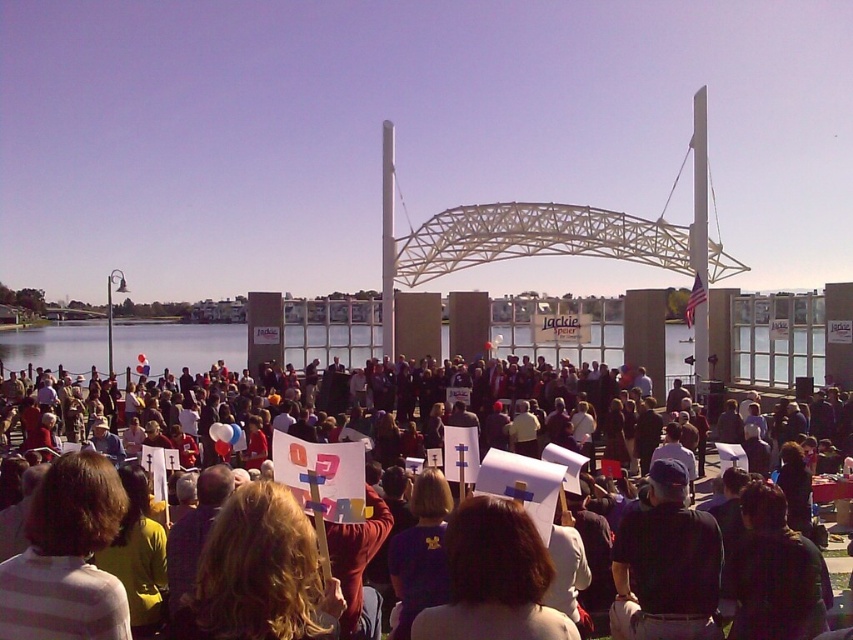
Question: Which point appears farthest from the camera in this image?

Choices:
 (A) (309, 426)
 (B) (657, 488)

Answer: (A)

Question: Which object appears closest to the camera in this image?

Choices:
 (A) dark blue fabric at center
 (B) white paper signs at center

Answer: (B)

Question: Is white paper signs at center positioned behind dark blue fabric at center?

Choices:
 (A) yes
 (B) no

Answer: (B)

Question: Can you confirm if white paper signs at center is positioned to the left of dark blue fabric at center?

Choices:
 (A) no
 (B) yes

Answer: (B)

Question: Which point is closer to the camera?

Choices:
 (A) dark blue fabric at center
 (B) white paper signs at center

Answer: (B)

Question: Is white paper signs at center to the left of dark blue fabric at center from the viewer's perspective?

Choices:
 (A) yes
 (B) no

Answer: (A)